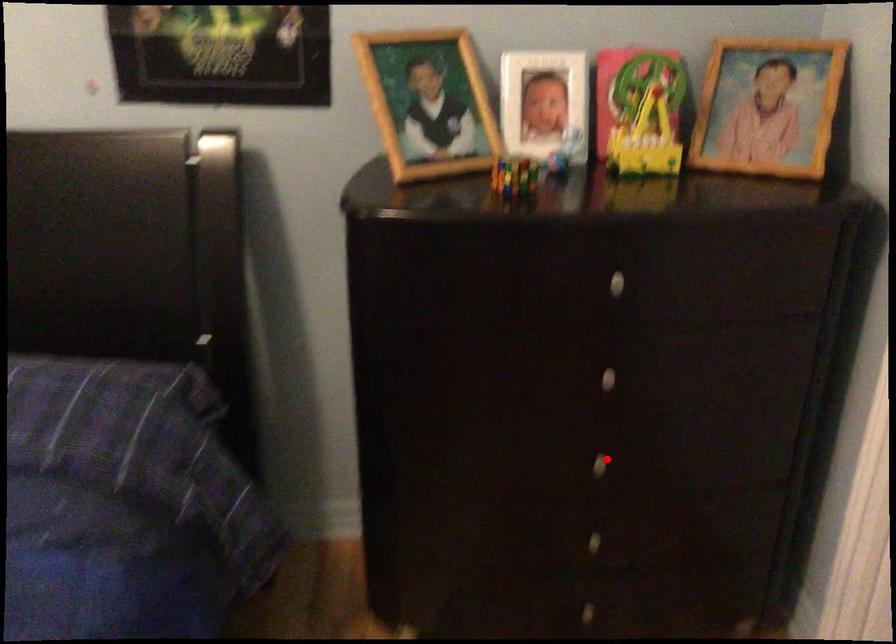
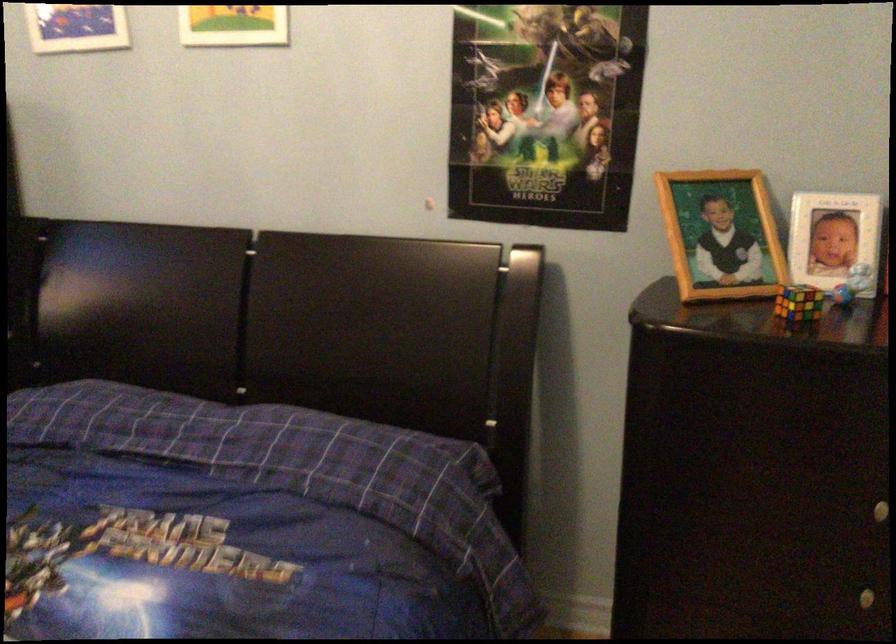
Where in the second image is the point corresponding to the highlighted location from the first image?

(868, 597)